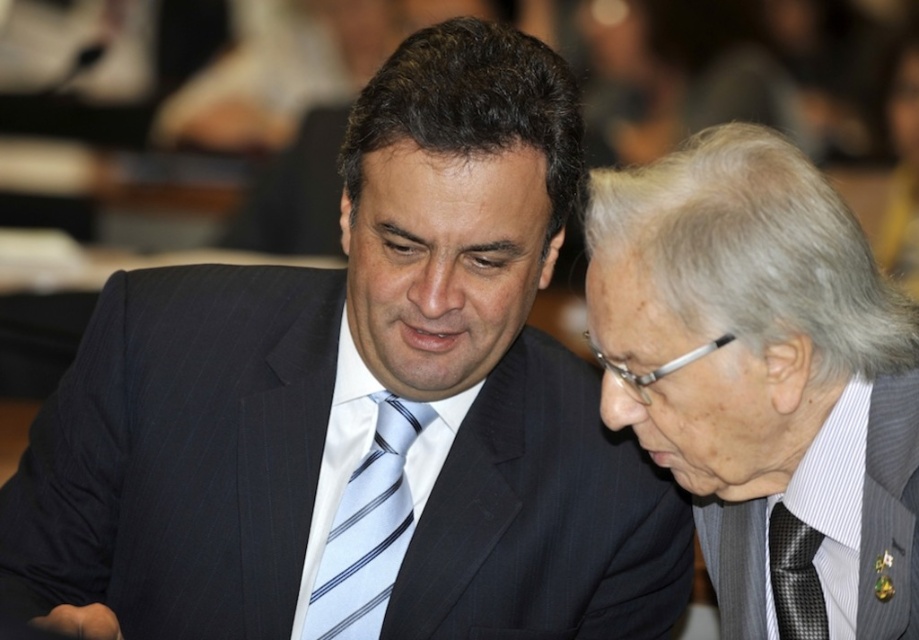
You are a photographer setting up for a group photo. You notice the dark blue pinstripe suit at center and the light blue striped tie at center in the scene. From the photographer viewpoint, which object is positioned to the left?

The light blue striped tie at center is positioned to the left of the dark blue pinstripe suit at center.

You are standing in front of the scene and want to pick up the item closest to you. Which point should you go to, point (584, 547) or point (324, 580)?

Point (584, 547) is closer to you than point (324, 580), so you should go to point (584, 547).